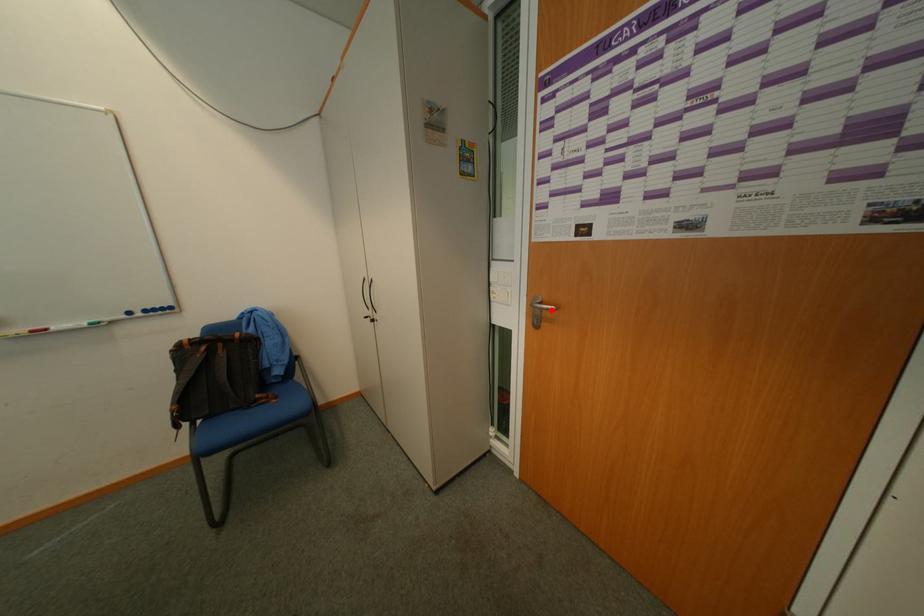
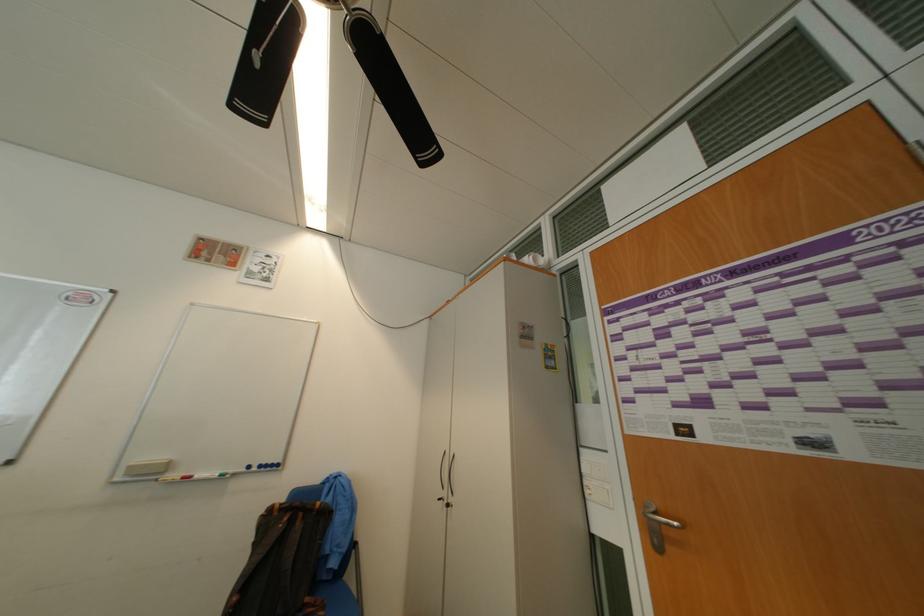
The point at the highlighted location is marked in the first image. Where is the corresponding point in the second image?

(670, 524)